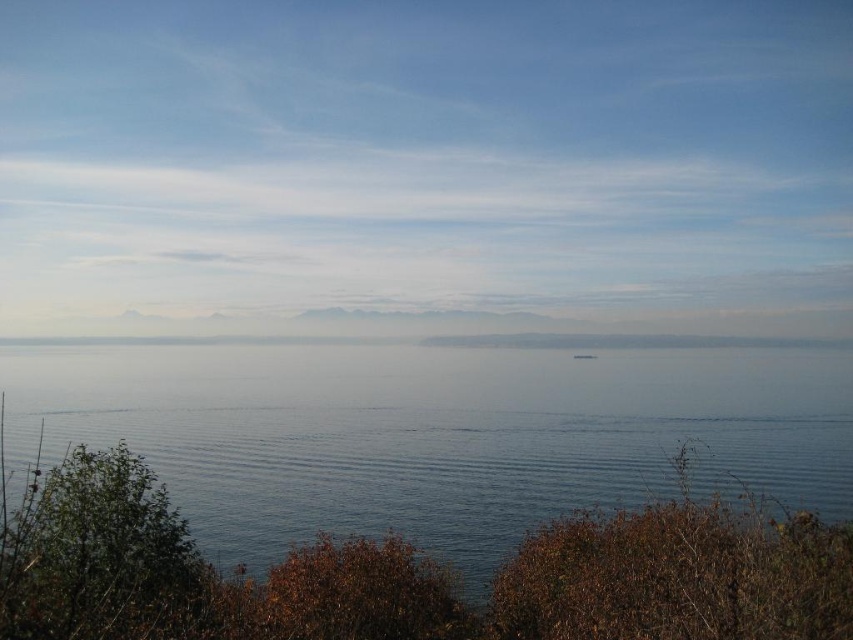
You are standing at the shore looking out at the seascape. There are two points marked in the image. Which point, point (416, 484) or point (573, 355), is closer to you?

Point (416, 484) is closer to you than point (573, 355).

You are standing on a cliff overlooking the sea. You see the transparent water at center and the white plastic boat at center. Which object is closer to you?

The transparent water at center is closer to the viewer than the white plastic boat at center.

You are standing at the shore looking out at the seascape. You see the transparent water at center and the white plastic boat at center. Which object is wider from your perspective?

The transparent water at center is wider than the white plastic boat at center according to the description.